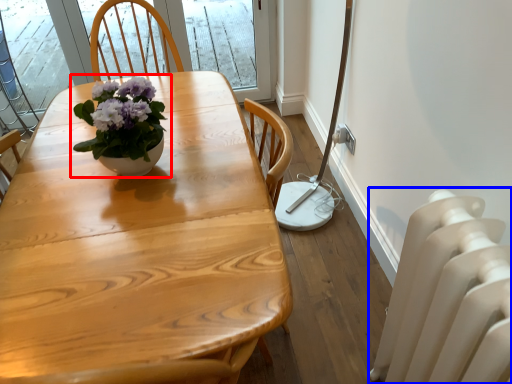
Question: Which object is further to the camera taking this photo, houseplant (highlighted by a red box) or radiator (highlighted by a blue box)?

Choices:
 (A) houseplant
 (B) radiator

Answer: (A)